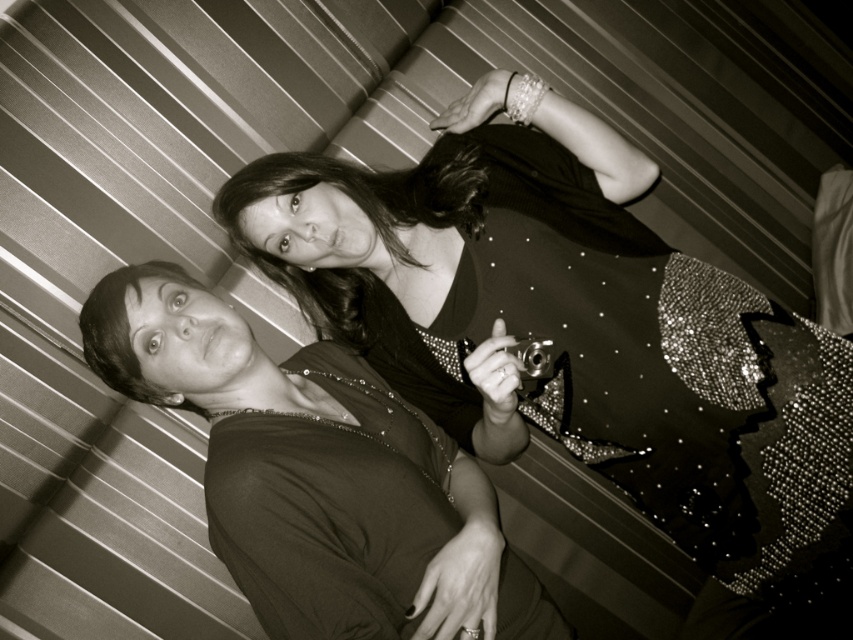
The image size is (853, 640). What are the coordinates of `shiny sequined dress at center` in the screenshot? It's located at (569, 324).

Is shiny sequined dress at center shorter than matte black dress at center?

No.

This screenshot has width=853, height=640. Identify the location of shiny sequined dress at center. (569, 324).

The image size is (853, 640). Identify the location of shiny sequined dress at center. (569, 324).